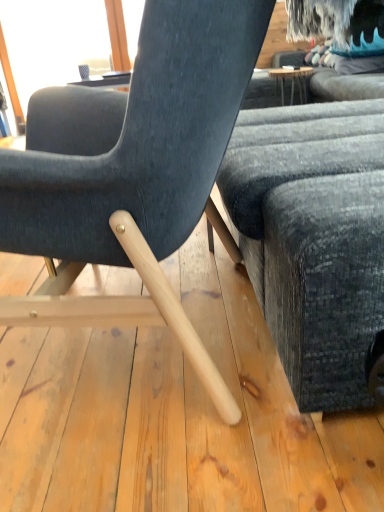
Identify the location of dark gray fabric couch at right. Image resolution: width=384 pixels, height=512 pixels. (313, 238).

Measure the distance between point (296, 120) and camera.

Point (296, 120) is 1.37 meters from camera.

This screenshot has height=512, width=384. Describe the element at coordinates (313, 238) in the screenshot. I see `dark gray fabric couch at right` at that location.

Where is `velvet dark blue chair at center`? The image size is (384, 512). velvet dark blue chair at center is located at coordinates point(140,178).

The height and width of the screenshot is (512, 384). What do you see at coordinates (140, 178) in the screenshot?
I see `velvet dark blue chair at center` at bounding box center [140, 178].

Measure the distance between point (11, 169) and camera.

Point (11, 169) is 24.09 inches from camera.

Locate an element on the screen. dark gray fabric couch at right is located at coordinates (313, 238).

Which is more to the right, velvet dark blue chair at center or dark gray fabric couch at right?

Positioned to the right is dark gray fabric couch at right.

Which object is closer to the camera taking this photo, velvet dark blue chair at center or dark gray fabric couch at right?

velvet dark blue chair at center is in front.

Which is closer to the camera, (148, 246) or (288, 308)?

The point (148, 246) is closer.

From the image's perspective, between velvet dark blue chair at center and dark gray fabric couch at right, who is located below?

velvet dark blue chair at center.

From a real-world perspective, is velvet dark blue chair at center positioned over dark gray fabric couch at right based on gravity?

Yes, from a real-world perspective, velvet dark blue chair at center is over dark gray fabric couch at right

Is velvet dark blue chair at center wider or thinner than dark gray fabric couch at right?

Considering their sizes, velvet dark blue chair at center looks broader than dark gray fabric couch at right.

Does velvet dark blue chair at center have a greater height compared to dark gray fabric couch at right?

Correct, velvet dark blue chair at center is much taller as dark gray fabric couch at right.

Is velvet dark blue chair at center bigger than dark gray fabric couch at right?

No.

Is velvet dark blue chair at center inside the boundaries of dark gray fabric couch at right, or outside?

velvet dark blue chair at center lies outside dark gray fabric couch at right.

Is velvet dark blue chair at center positioned far away from dark gray fabric couch at right?

velvet dark blue chair at center is near dark gray fabric couch at right, not far away.

Is velvet dark blue chair at center facing towards dark gray fabric couch at right?

No, velvet dark blue chair at center is not turned towards dark gray fabric couch at right.

Can you tell me how much velvet dark blue chair at center and dark gray fabric couch at right differ in facing direction?

The angle between the facing direction of velvet dark blue chair at center and the facing direction of dark gray fabric couch at right is 6.76 degrees.

At what (x,y) coordinates should I click in order to perform the action: click on studio couch below the velvet dark blue chair at center (from a real-world perspective). Please return your answer as a coordinate pair (x, y). The image size is (384, 512). Looking at the image, I should click on [313, 238].

Which object is positioned more to the left, dark gray fabric couch at right or velvet dark blue chair at center?

velvet dark blue chair at center.

Does dark gray fabric couch at right come in front of velvet dark blue chair at center?

No, it is not.

Is point (367, 248) positioned after point (129, 130)?

Yes, point (367, 248) is behind point (129, 130).

From the image's perspective, which is above, dark gray fabric couch at right or velvet dark blue chair at center?

dark gray fabric couch at right appears higher in the image.

From a real-world perspective, which object rests below the other?

In real-world perspective, dark gray fabric couch at right is lower.

In terms of width, does dark gray fabric couch at right look wider or thinner when compared to velvet dark blue chair at center?

Clearly, dark gray fabric couch at right has less width compared to velvet dark blue chair at center.

Which of these two, dark gray fabric couch at right or velvet dark blue chair at center, stands taller?

velvet dark blue chair at center is taller.

Considering the sizes of dark gray fabric couch at right and velvet dark blue chair at center in the image, is dark gray fabric couch at right bigger or smaller than velvet dark blue chair at center?

Considering their sizes, dark gray fabric couch at right takes up more space than velvet dark blue chair at center.

Is dark gray fabric couch at right located outside velvet dark blue chair at center?

Yes, dark gray fabric couch at right is not within velvet dark blue chair at center.

Is dark gray fabric couch at right next to velvet dark blue chair at center and touching it?

They are not placed beside each other.

Is dark gray fabric couch at right aimed at velvet dark blue chair at center?

Yes, dark gray fabric couch at right faces towards velvet dark blue chair at center.

The height and width of the screenshot is (512, 384). Identify the location of chair on the left side of dark gray fabric couch at right. (140, 178).

Identify the location of chair that appears below the dark gray fabric couch at right (from the image's perspective). The height and width of the screenshot is (512, 384). (140, 178).

The width and height of the screenshot is (384, 512). Identify the location of studio couch on the right side of velvet dark blue chair at center. (313, 238).